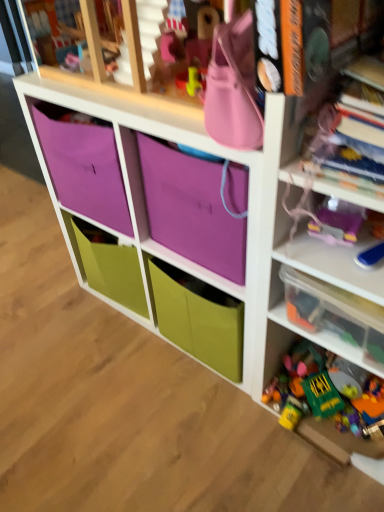
This screenshot has height=512, width=384. I want to click on free space to the left of plastic colorful toys at lower right, so click(234, 440).